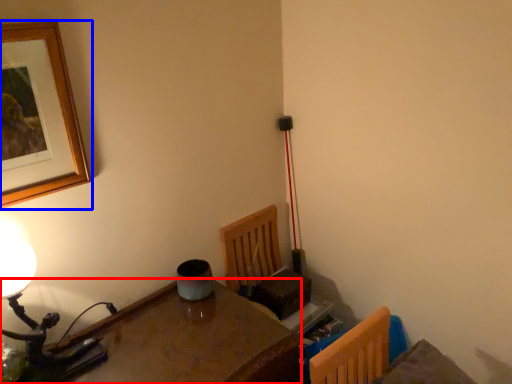
Question: Which object appears farthest to the camera in this image, table (highlighted by a red box) or picture frame (highlighted by a blue box)?

Choices:
 (A) table
 (B) picture frame

Answer: (B)